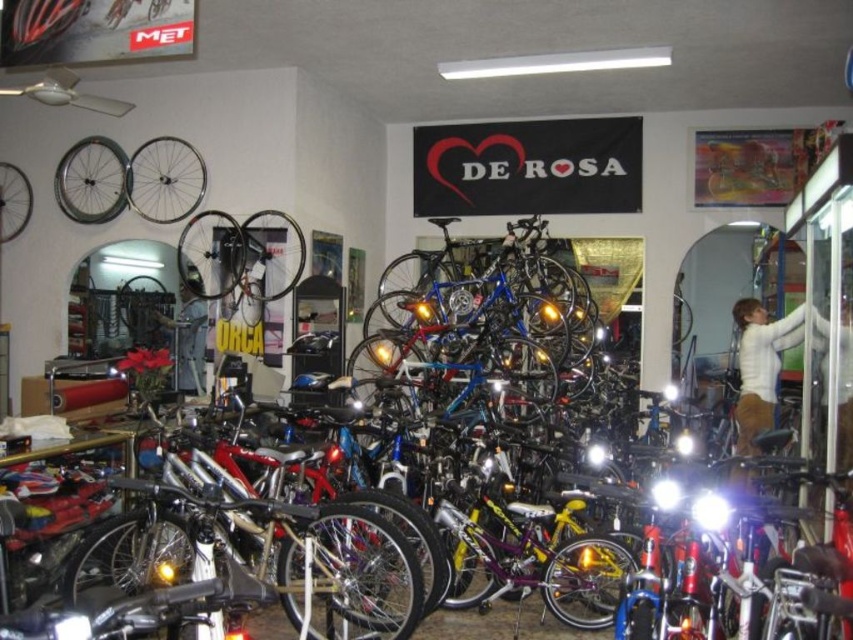
Looking at this image, you are a customer in the bicycle shop and want to know if the shiny silver wheel at upper left can fit through the doorway without bending the denim jacket at center. Can you determine this based on their widths?

The shiny silver wheel at upper left might be wider than denim jacket at center, so there is a possibility that it could bend the denim jacket at center when moving through the doorway. It is recommended to check the exact measurements or consult the shop staff for assistance.

You are a customer in the bicycle shop and want to see the shiny silver wheel at upper left and the white matte shirt at right. Which object is closer to you?

The shiny silver wheel at upper left is closer to you because it is further to the viewer than the white matte shirt at right.

You are a customer in the bicycle shop and want to know if the shiny silver wheel at upper left can fit into a box designed for the white matte shirt at right. Based on their sizes, can the wheel fit?

The shiny silver wheel at upper left has a larger width than the white matte shirt at right, so the wheel cannot fit into the box designed for the shirt.